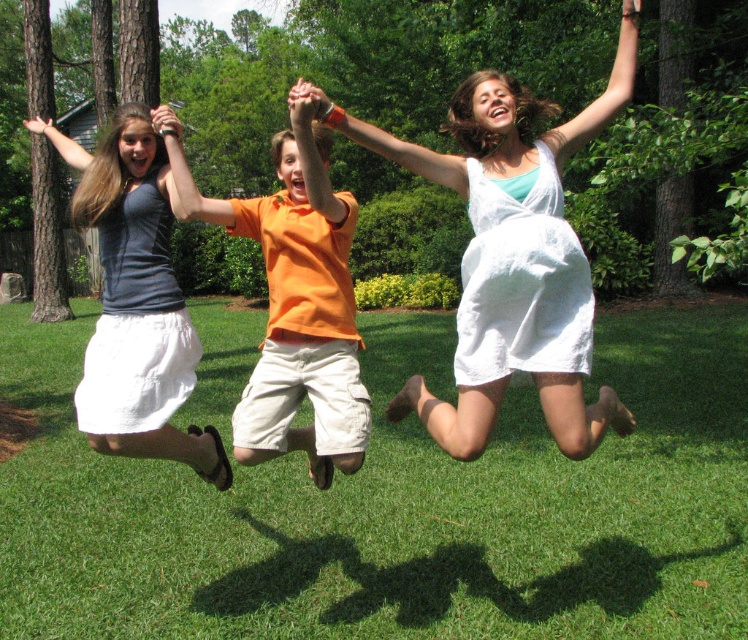
Does orange cotton shirt at center have a lesser height compared to white linen dress at center?

Yes, orange cotton shirt at center is shorter than white linen dress at center.

Looking at this image, is orange cotton shirt at center positioned at the back of white linen dress at center?

That is True.

Between point (316, 305) and point (497, 93), which one is positioned in front?

Point (497, 93)

Where is `orange cotton shirt at center`? The image size is (748, 640). orange cotton shirt at center is located at coordinates (301, 308).

Does point (257, 403) come farther from viewer compared to point (99, 225)?

No, (257, 403) is in front of (99, 225).

Between point (285, 189) and point (150, 170), which one is positioned behind?

Point (285, 189)

Between point (283, 435) and point (131, 204), which one is positioned behind?

The point (131, 204) is more distant.

Identify the location of orange cotton shirt at center. (301, 308).

What do you see at coordinates (396, 506) in the screenshot? The image size is (748, 640). I see `green grass at center` at bounding box center [396, 506].

Looking at this image, can you confirm if green grass at center is positioned to the left of orange cotton shirt at center?

Incorrect, green grass at center is not on the left side of orange cotton shirt at center.

Who is more distant from viewer, (404,452) or (337,259)?

Positioned behind is point (404,452).

The width and height of the screenshot is (748, 640). I want to click on green grass at center, so click(396, 506).